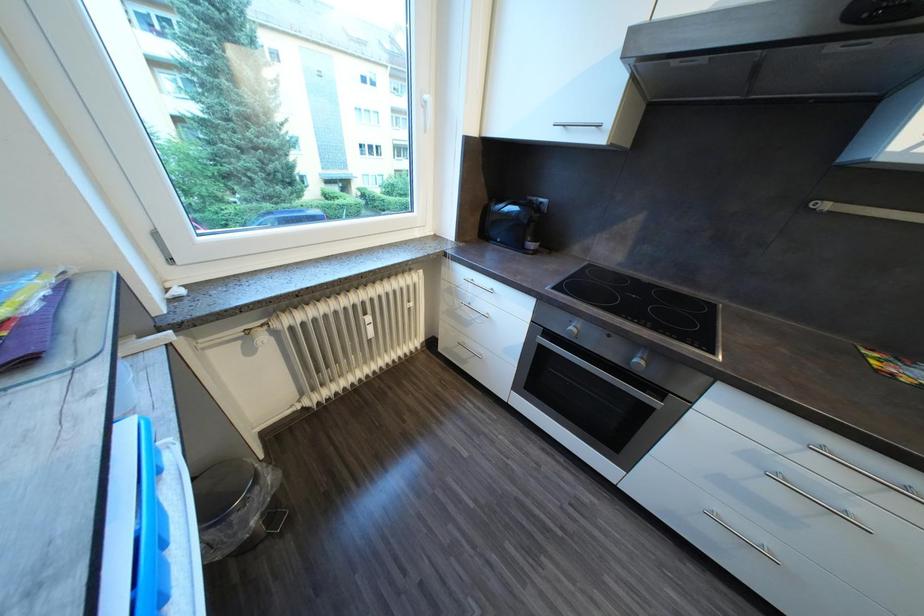
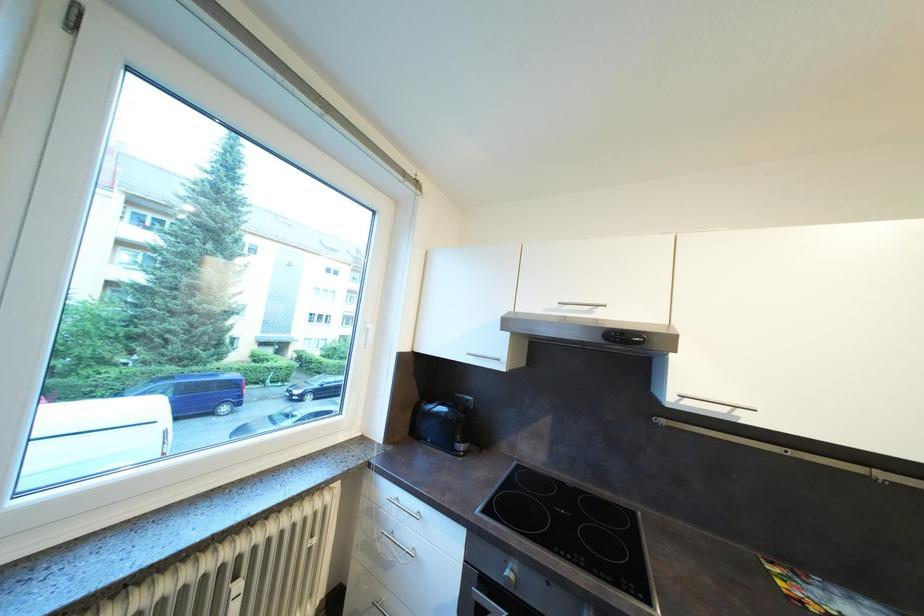
How did the camera likely rotate?

The camera rotated toward right-up.